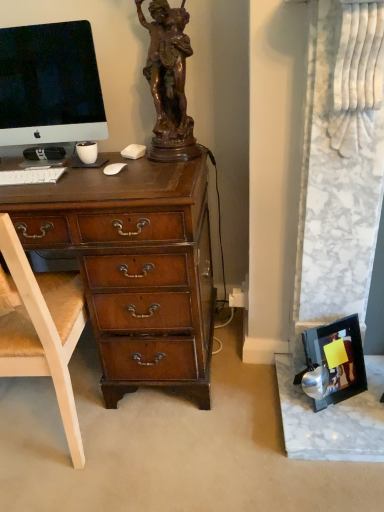
Question: Is satin black monitor at upper left thinner than white wood chair at left?

Choices:
 (A) yes
 (B) no

Answer: (A)

Question: From a real-world perspective, does satin black monitor at upper left sit lower than white wood chair at left?

Choices:
 (A) no
 (B) yes

Answer: (A)

Question: Would you say satin black monitor at upper left contains white wood chair at left?

Choices:
 (A) yes
 (B) no

Answer: (B)

Question: Can you see satin black monitor at upper left touching white wood chair at left?

Choices:
 (A) yes
 (B) no

Answer: (B)

Question: Can you confirm if satin black monitor at upper left is positioned to the left of white wood chair at left?

Choices:
 (A) yes
 (B) no

Answer: (B)

Question: Considering their positions, is metallic silver picture frame at lower right located in front of or behind white wood chair at left?

Choices:
 (A) front
 (B) behind

Answer: (B)

Question: Considering the positions of metallic silver picture frame at lower right and white wood chair at left in the image, is metallic silver picture frame at lower right bigger or smaller than white wood chair at left?

Choices:
 (A) small
 (B) big

Answer: (A)

Question: From the image's perspective, is metallic silver picture frame at lower right above or below white wood chair at left?

Choices:
 (A) below
 (B) above

Answer: (A)

Question: Is metallic silver picture frame at lower right wider or thinner than white wood chair at left?

Choices:
 (A) wide
 (B) thin

Answer: (B)

Question: Is white plastic power outlet at lower center taller or shorter than white matte keyboard at left?

Choices:
 (A) short
 (B) tall

Answer: (B)

Question: From the image's perspective, is white plastic power outlet at lower center located above or below white matte keyboard at left?

Choices:
 (A) above
 (B) below

Answer: (B)

Question: Is white plastic power outlet at lower center wider or thinner than white matte keyboard at left?

Choices:
 (A) thin
 (B) wide

Answer: (A)

Question: Do you think white plastic power outlet at lower center is within white matte keyboard at left, or outside of it?

Choices:
 (A) outside
 (B) inside

Answer: (A)

Question: From a real-world perspective, relative to white plastic power outlet at lower center, is satin black monitor at upper left vertically above or below?

Choices:
 (A) above
 (B) below

Answer: (A)

Question: Is point (23, 106) positioned closer to the camera than point (241, 300)?

Choices:
 (A) closer
 (B) farther

Answer: (A)